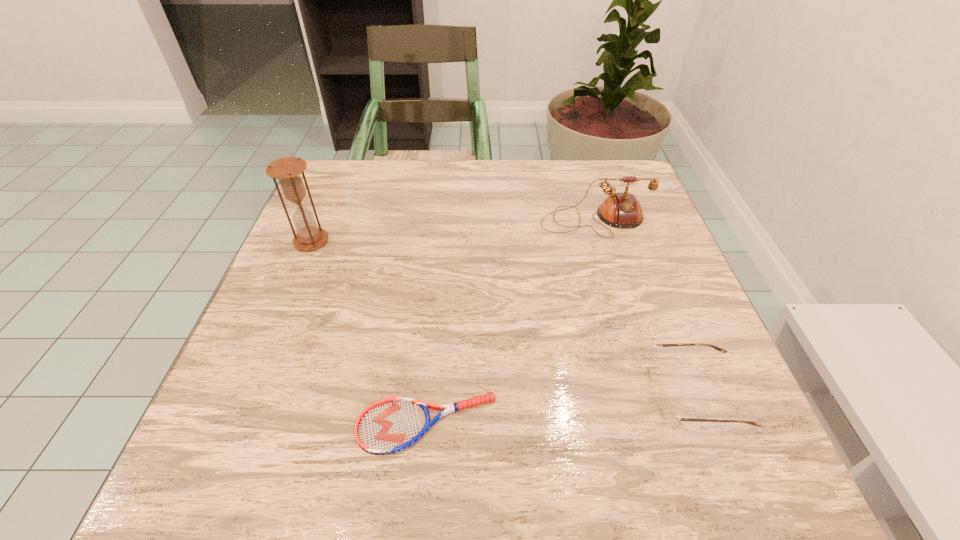
I want to click on empty space that is in between the telephone and the second shortest object, so click(x=645, y=307).

This screenshot has width=960, height=540. Find the location of `empty location between the second tallest object and the shortest object`. empty location between the second tallest object and the shortest object is located at coordinates (511, 322).

Locate an element on the screen. vacant area between the telephone and the tallest object is located at coordinates click(x=453, y=231).

Identify the location of vacant area that lies between the spectacles and the telephone. (645, 307).

Image resolution: width=960 pixels, height=540 pixels. What are the coordinates of `the third closest object relative to the shortest object` in the screenshot? It's located at (619, 210).

In order to click on object that is the closest one to the telephone in this screenshot , I will do `click(666, 408)`.